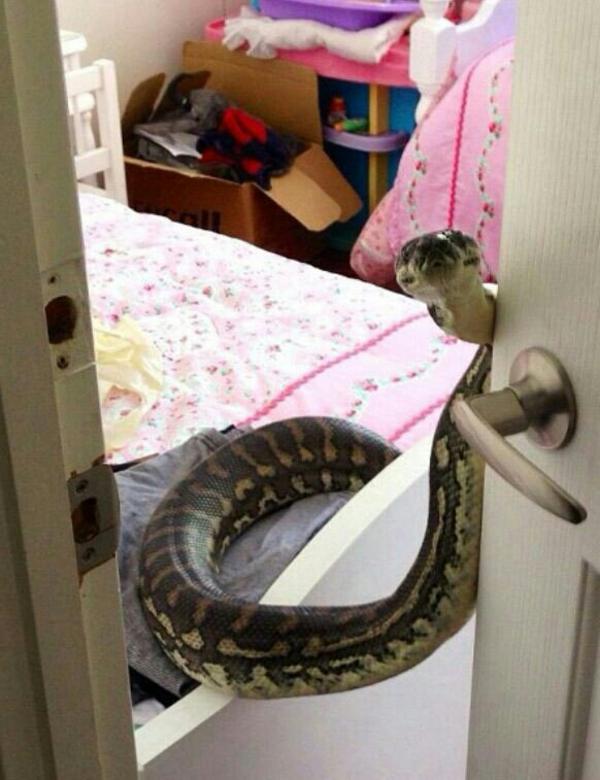
Where is `blanket`? The height and width of the screenshot is (780, 600). blanket is located at coordinates (180, 263).